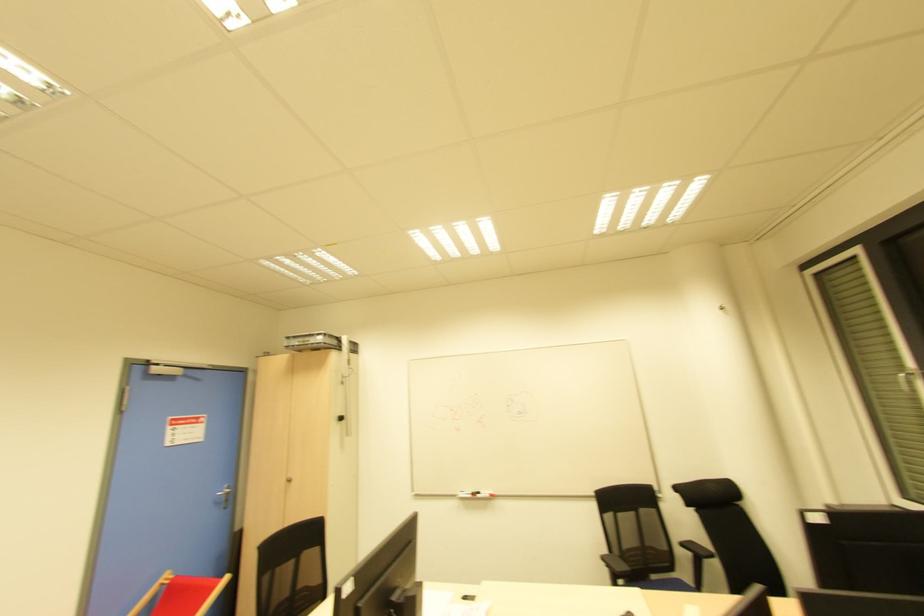
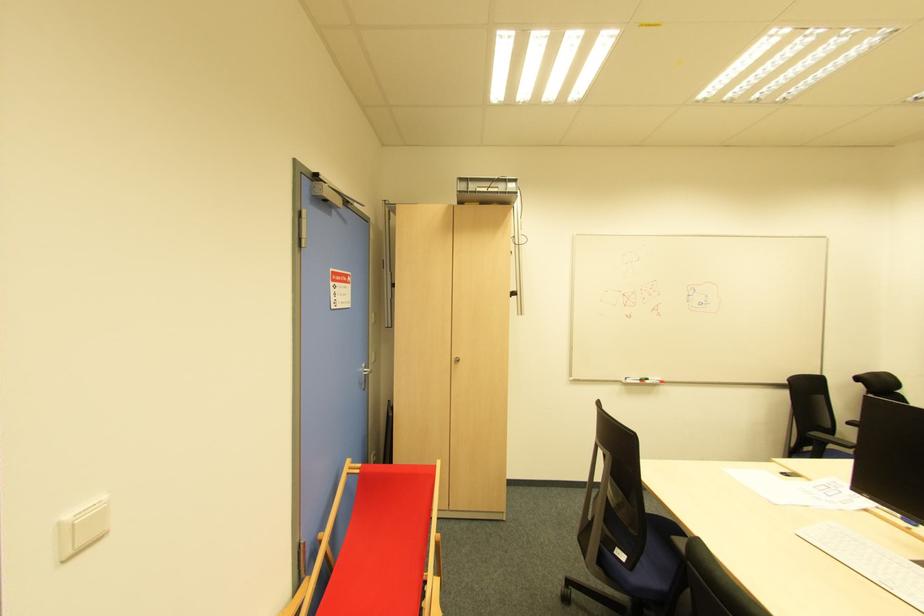
In the second image, find the point that corresponds to point 492,496 in the first image.

(662, 383)